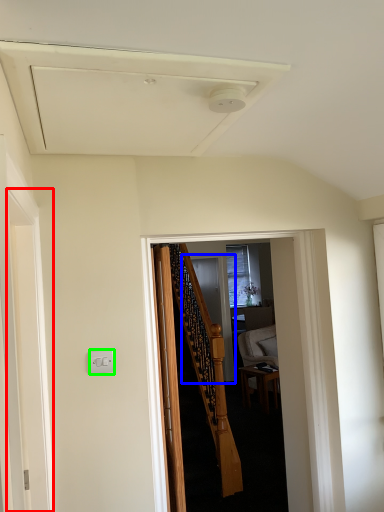
Question: Which object is the closest to the screen door (highlighted by a red box)? Choose among these: screen door (highlighted by a blue box) or electric outlet (highlighted by a green box).

Choices:
 (A) screen door
 (B) electric outlet

Answer: (B)